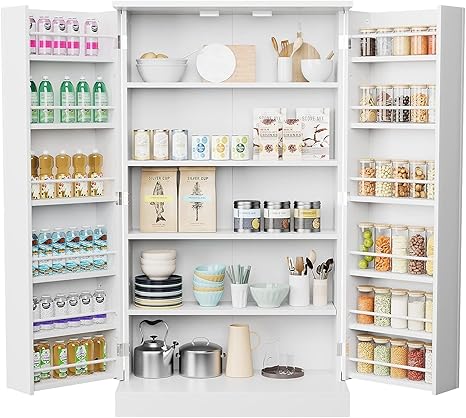
Locate an element on the screen. This screenshot has width=466, height=418. bottles on shelf below top shelf on left side is located at coordinates (99, 88), (83, 96), (67, 98), (45, 100), (31, 101).